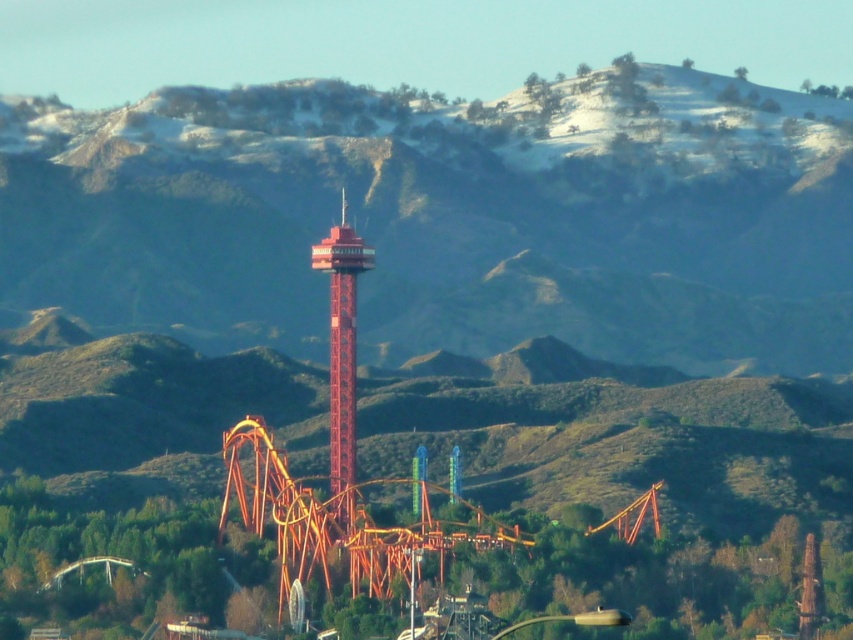
You are a visitor at the amusement park and want to take a photo of the smooth red tower at center without the smooth brown mountain at center blocking it. Is this possible given their positions?

The smooth brown mountain at center is in front of the smooth red tower at center, so it will block the view. To capture the tower without the mountain, you would need to move to a position where the mountain is no longer between you and the tower, such as behind the mountain or to the side where the mountain doesn not obstruct the view.

You are a park visitor who wants to take a photo of both the smooth brown mountain at center and the smooth red tower at center. Which object will appear larger in your camera viewfinder?

The smooth brown mountain at center will appear larger in the camera viewfinder because it has a larger size compared to the smooth red tower at center.